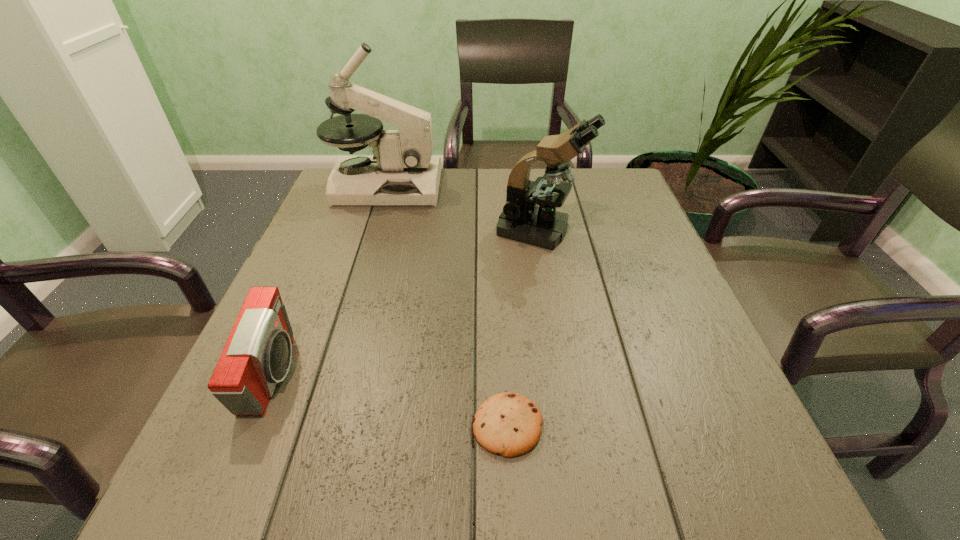
Where is `object that is the nearest to the third tallest object`? object that is the nearest to the third tallest object is located at coordinates (509, 424).

Identify the location of the second closest object to the third tallest object. This screenshot has width=960, height=540. (401, 172).

Where is `vacant area in the image that satisfies the following two spatial constraints: 1. at the eyepiece of the left microscope; 2. on the back side of the second tallest object`? vacant area in the image that satisfies the following two spatial constraints: 1. at the eyepiece of the left microscope; 2. on the back side of the second tallest object is located at coordinates (372, 230).

Find the location of a particular element. free space that satisfies the following two spatial constraints: 1. on the front-facing side of the cookie; 2. on the right side of the third tallest object is located at coordinates 252,426.

The height and width of the screenshot is (540, 960). What are the coordinates of `vacant area in the image that satisfies the following two spatial constraints: 1. on the front-facing side of the cookie; 2. on the left side of the camera` in the screenshot? It's located at (252, 426).

The width and height of the screenshot is (960, 540). I want to click on vacant space that satisfies the following two spatial constraints: 1. on the front-facing side of the shortest object; 2. on the left side of the camera, so click(x=252, y=426).

I want to click on vacant space that satisfies the following two spatial constraints: 1. on the back side of the third nearest object; 2. at the eyepiece of the farther microscope, so click(532, 186).

Locate an element on the screen. The image size is (960, 540). blank space that satisfies the following two spatial constraints: 1. at the eyepiece of the tallest object; 2. on the right side of the shorter microscope is located at coordinates (372, 230).

Identify the location of vacant point that satisfies the following two spatial constraints: 1. at the eyepiece of the tallest object; 2. on the back side of the shortest object. The image size is (960, 540). (312, 426).

You are a GUI agent. You are given a task and a screenshot of the screen. Output one action in this format:
    pyautogui.click(x=<x>, y=<y>)
    Task: Click on the vacant space that satisfies the following two spatial constraints: 1. on the front-facing side of the third tallest object; 2. on the left side of the cookie
    
    Given the screenshot: What is the action you would take?
    pyautogui.click(x=252, y=426)